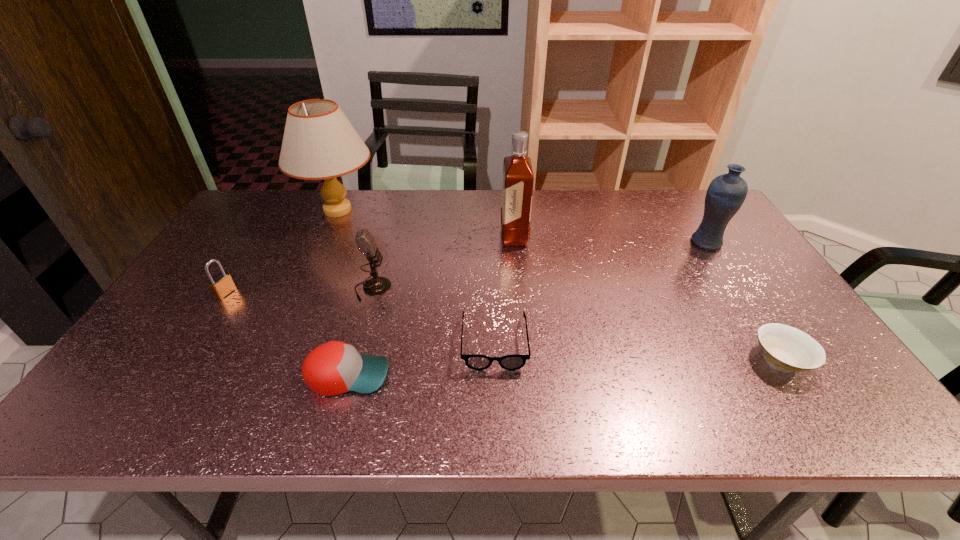
The image size is (960, 540). I want to click on liquor located at the far edge, so 518,179.

Find the location of a particular element. object at the near edge is located at coordinates (333, 368).

This screenshot has height=540, width=960. What are the coordinates of `object situated at the left edge` in the screenshot? It's located at (222, 284).

This screenshot has height=540, width=960. I want to click on vase positioned at the right edge, so click(726, 193).

At what (x,y) coordinates should I click in order to perform the action: click on bowl that is at the right edge. Please return your answer as a coordinate pair (x, y). Looking at the image, I should click on (786, 348).

Image resolution: width=960 pixels, height=540 pixels. I want to click on vacant space at the far edge, so click(581, 210).

I want to click on vacant space at the near edge of the desktop, so click(x=348, y=424).

This screenshot has width=960, height=540. What are the coordinates of `vacant space at the left edge` in the screenshot? It's located at (220, 317).

Find the location of a particular element. Image resolution: width=960 pixels, height=540 pixels. free space at the right edge of the desktop is located at coordinates (711, 257).

You are a GUI agent. You are given a task and a screenshot of the screen. Output one action in this format:
    pyautogui.click(x=<x>, y=<y>)
    Task: Click on the vacant area at the far left corner
    The width and height of the screenshot is (960, 540).
    Given the screenshot: What is the action you would take?
    pyautogui.click(x=267, y=218)